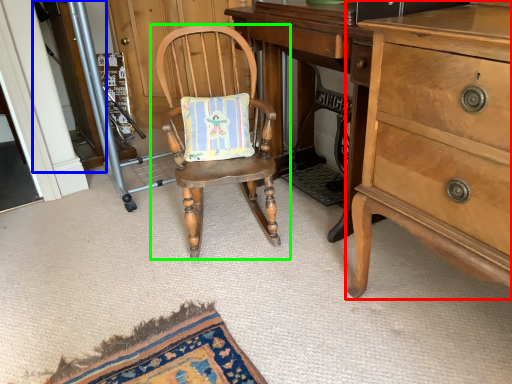
Question: Which is farther away from cabinetry (highlighted by a red box)? screen door (highlighted by a blue box) or chair (highlighted by a green box)?

Choices:
 (A) screen door
 (B) chair

Answer: (A)